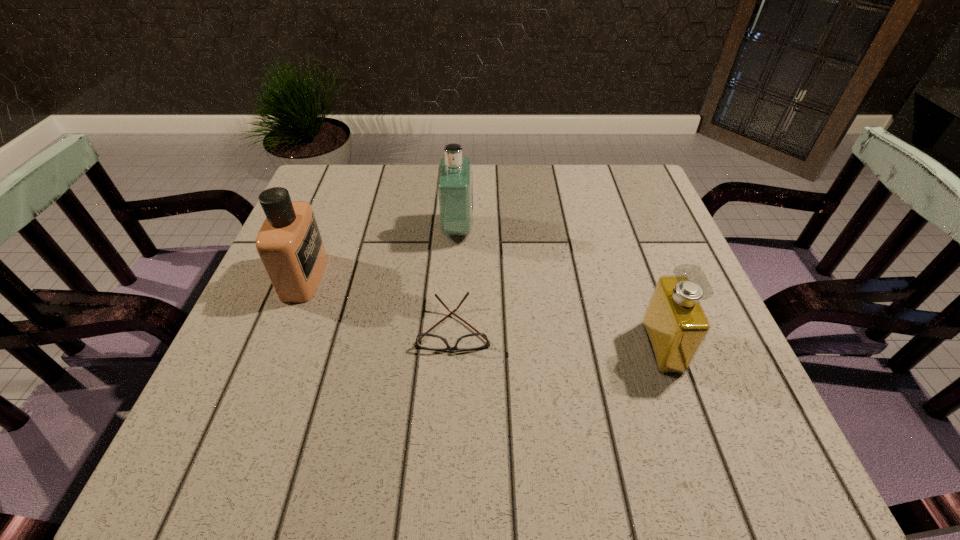
Locate an element on the screen. The width and height of the screenshot is (960, 540). vacant space that's between the farthest object and the shortest object is located at coordinates pyautogui.click(x=455, y=278).

Where is `blank region between the leftmost object and the rightmost perfume`? blank region between the leftmost object and the rightmost perfume is located at coordinates pyautogui.click(x=484, y=312).

Locate an element on the screen. This screenshot has width=960, height=540. the closest object to the farthest perfume is located at coordinates (478, 340).

The image size is (960, 540). I want to click on object that is the third closest to the shortest object, so click(675, 324).

Identify which perfume is located as the nearest to the nearest perfume. Please provide its 2D coordinates. Your answer should be formatted as a tuple, i.e. [(x, y)], where the tuple contains the x and y coordinates of a point satisfying the conditions above.

[(454, 185)]

Choose which perfume is the second nearest neighbor to the rightmost object. Please provide its 2D coordinates. Your answer should be formatted as a tuple, i.e. [(x, y)], where the tuple contains the x and y coordinates of a point satisfying the conditions above.

[(289, 243)]